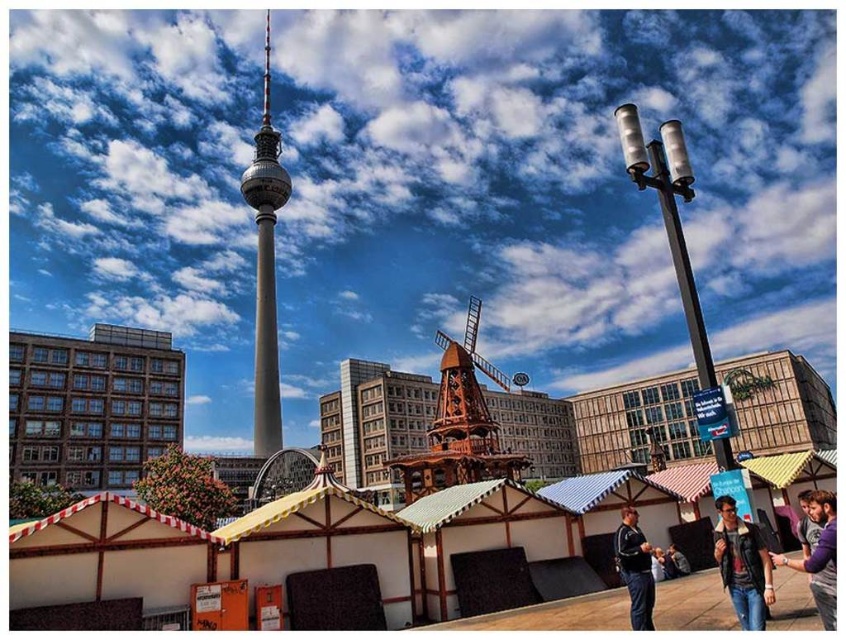
Question: Which point is farther to the camera?

Choices:
 (A) (680, 566)
 (B) (724, 509)
 (C) (618, 116)
 (D) (495, 378)

Answer: (D)

Question: Considering the real-world distances, which object is farthest from the dark blue shirt at lower right?

Choices:
 (A) wooden windmill at center
 (B) beige fabric jacket at lower right
 (C) smooth gray tower at center
 (D) metallic silver streetlight at upper right

Answer: (C)

Question: Does wooden windmill at center have a larger size compared to metallic silver streetlight at upper right?

Choices:
 (A) no
 (B) yes

Answer: (A)

Question: Considering the relative positions of wooden windmill at center and dark blue jeans at lower right in the image provided, where is wooden windmill at center located with respect to dark blue jeans at lower right?

Choices:
 (A) below
 (B) above

Answer: (B)

Question: Which point appears farthest from the camera in this image?

Choices:
 (A) (828, 576)
 (B) (669, 566)

Answer: (B)

Question: Does leather jacket at lower right come behind beige fabric jacket at lower right?

Choices:
 (A) no
 (B) yes

Answer: (B)